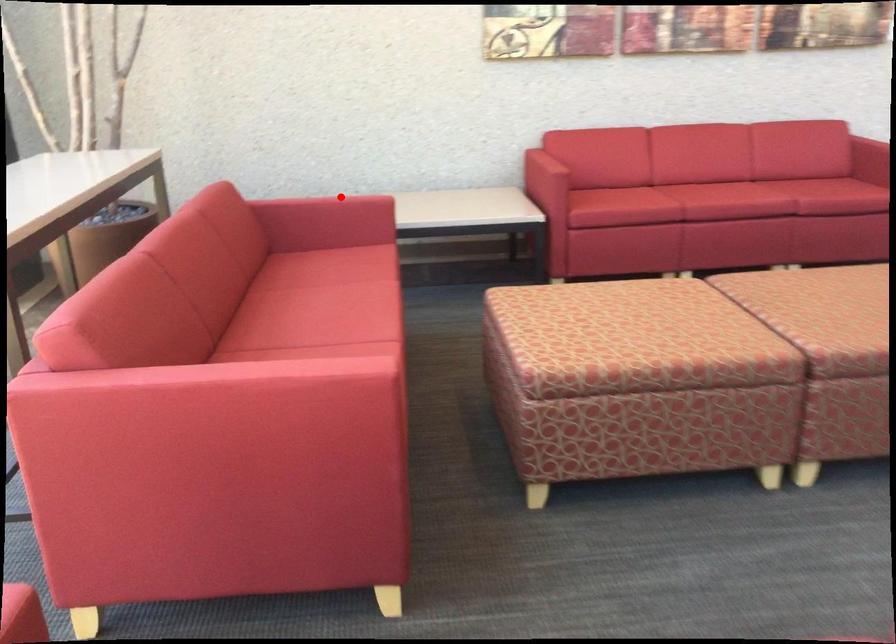
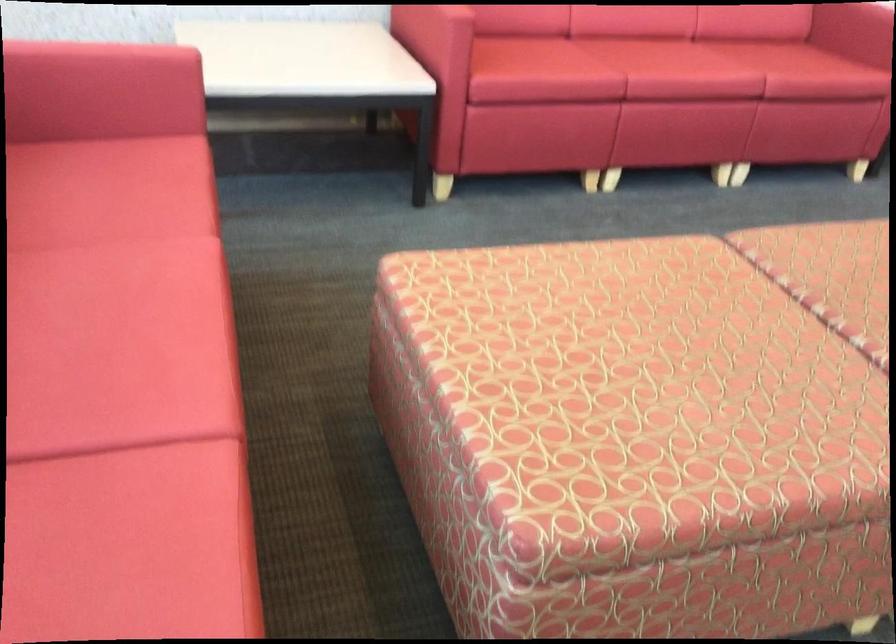
Question: I am providing you with two images of the same scene from different viewpoints. In image1, a red point is highlighted. Considering the same 3D point in image2, which of the following is correct?

Choices:
 (A) It is closer
 (B) It is farther

Answer: (A)